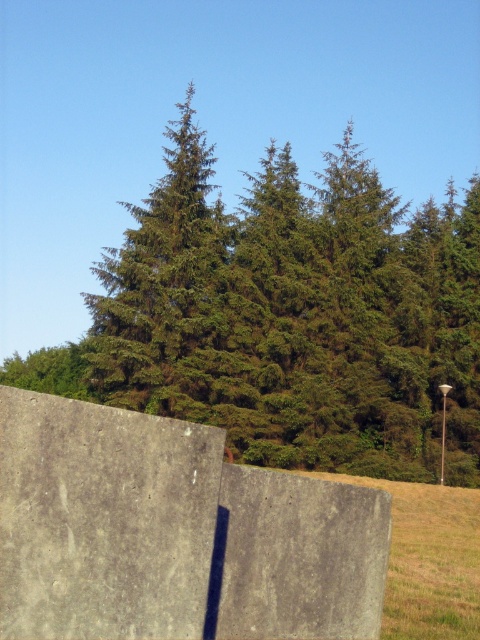
You are standing in the natural landscape and want to take a photo of both the green matte tree at center and the gray concrete wall at center. Which object should you position to your left to include both in the frame?

You should position the green matte tree at center to your left since it is already to the left of the gray concrete wall at center, allowing both to be captured in the frame.

You are standing at the origin point in the image. Can you see the green matte tree at center from your current position?

Yes, the green matte tree at center is located at point (288, 316), so it is visible from the origin point.

You are standing in the middle of the dense coniferous forest shown in the image. You notice a specific point marked at coordinates (288, 316). What object is located at this point?

The point at coordinates (288, 316) marks the green matte tree at center.